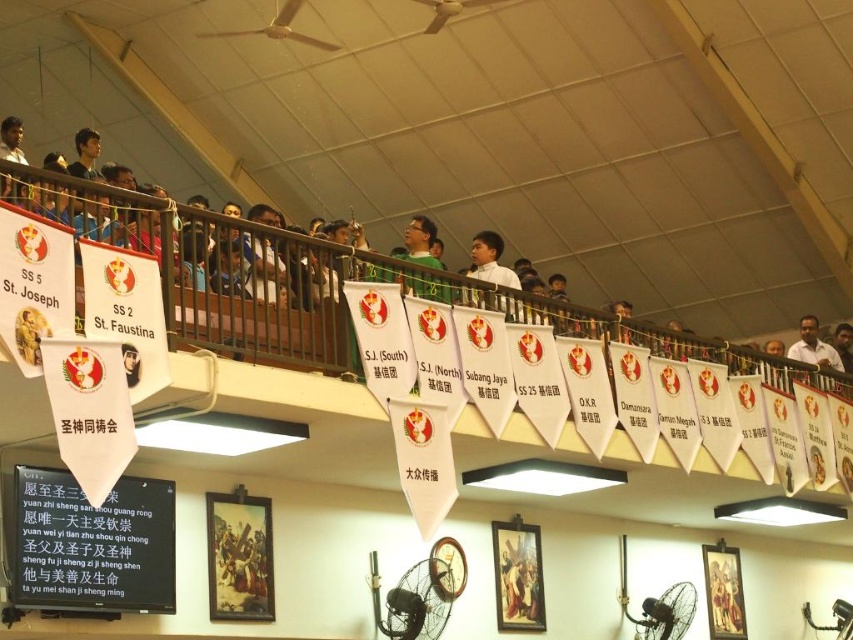
Question: Which object appears farthest from the camera in this image?

Choices:
 (A) dark skin man at upper right
 (B) white paper banner at upper center
 (C) white matte shirt at upper center

Answer: (A)

Question: Does white matte shirt at upper center appear under dark skin man at upper right?

Choices:
 (A) yes
 (B) no

Answer: (B)

Question: Observing the image, what is the correct spatial positioning of white paper banner at upper center in reference to dark skin man at upper right?

Choices:
 (A) left
 (B) right

Answer: (A)

Question: Which object is positioned closest to the white paper banner at upper center?

Choices:
 (A) white matte shirt at upper center
 (B) dark skin man at upper right

Answer: (A)

Question: Does white paper banner at upper center have a larger size compared to white matte shirt at upper center?

Choices:
 (A) no
 (B) yes

Answer: (B)

Question: Estimate the real-world distances between objects in this image. Which object is closer to the dark skin man at upper right?

Choices:
 (A) white matte shirt at upper center
 (B) white paper banner at upper center

Answer: (B)